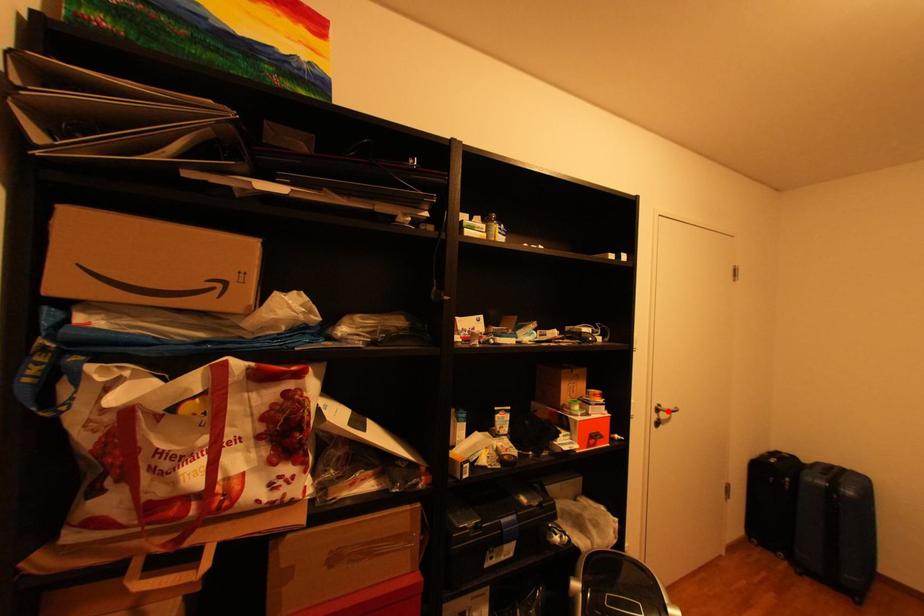
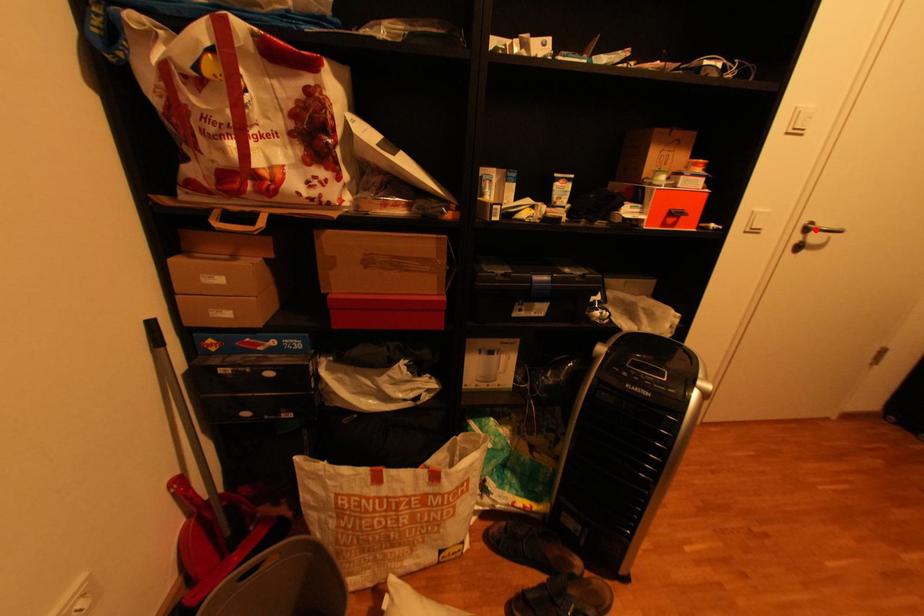
I am providing you with two images of the same scene from different viewpoints. A red point is marked on the first image and another point is marked on the second image. Do the highlighted points in image1 and image2 indicate the same real-world spot?

Yes